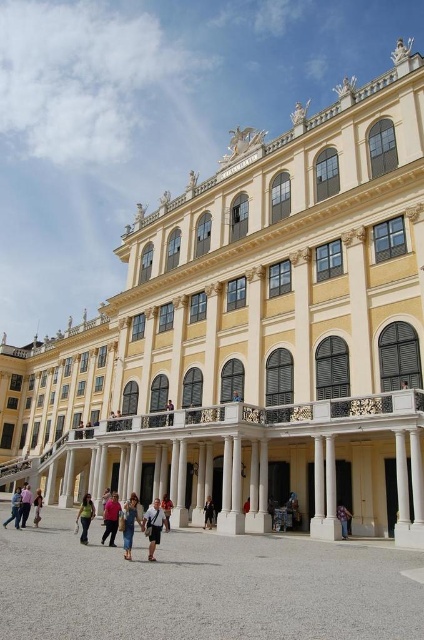
You are a photographer standing in the courtyard of the building. You want to take a photo that includes both the dark gray fabric jacket at center and the pink fabric dress at lower left. Which object should be placed in the foreground to ensure both are visible in the frame?

The dark gray fabric jacket at center should be placed in the foreground because it is positioned over the pink fabric dress at lower left, meaning it is closer to the camera. This placement ensures both the jacket and the dress are visible in the photo.

You are standing in the courtyard of the grand building and see the light brown wooden chair at center and the light brown leather bag at center. Which object is closer to you?

The light brown wooden chair at center is closer to you because it is further to the viewer than the light brown leather bag at center.

You are a photographer planning to capture a photo of the dark gray fabric jacket at center and the pink fabric dress at lower left. Considering their sizes, which one would you focus on to ensure it fits within the frame without cropping?

The dark gray fabric jacket at center is smaller than the pink fabric dress at lower left, so focusing on the pink fabric dress at lower left would ensure it fits within the frame without cropping since it is larger.